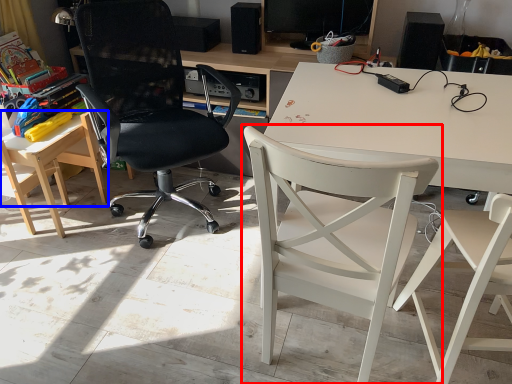
Question: Among these objects, which one is farthest to the camera, chair (highlighted by a red box) or table (highlighted by a blue box)?

Choices:
 (A) chair
 (B) table

Answer: (B)